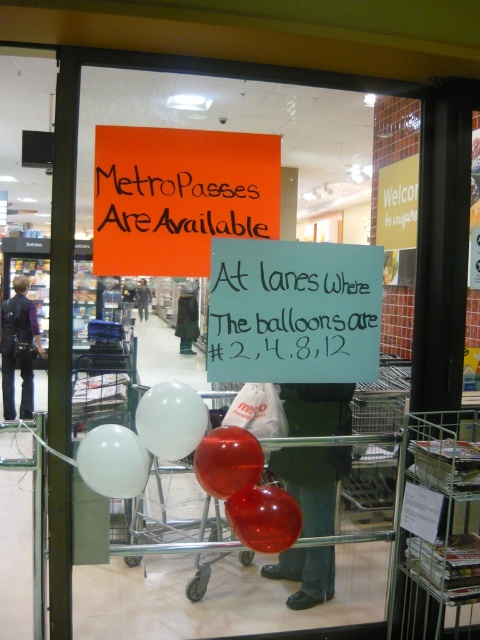
Who is more forward, [214,225] or [127,492]?

Point [127,492] is more forward.

What are the coordinates of `orange paper sign at upper center` in the screenshot? It's located at (182, 204).

What do you see at coordinates (182, 204) in the screenshot? I see `orange paper sign at upper center` at bounding box center [182, 204].

Find the location of a particular element. The height and width of the screenshot is (640, 480). orange paper sign at upper center is located at coordinates (182, 204).

Between point (202, 221) and point (37, 348), which one is positioned in front?

Point (202, 221) is in front.

Is orange paper sign at upper center wider than dark blue jeans at left?

Correct, the width of orange paper sign at upper center exceeds that of dark blue jeans at left.

What do you see at coordinates (182, 204) in the screenshot?
I see `orange paper sign at upper center` at bounding box center [182, 204].

I want to click on orange paper sign at upper center, so click(182, 204).

Does point (112, 429) lie behind point (146, 317)?

That is False.

Between white glossy balloon at lower left and matte black jacket at upper center, which one is positioned lower?

Positioned lower is white glossy balloon at lower left.

Find the location of a particular element. The image size is (480, 640). white glossy balloon at lower left is located at coordinates (112, 461).

The width and height of the screenshot is (480, 640). Find the location of `white glossy balloon at lower left`. white glossy balloon at lower left is located at coordinates (112, 461).